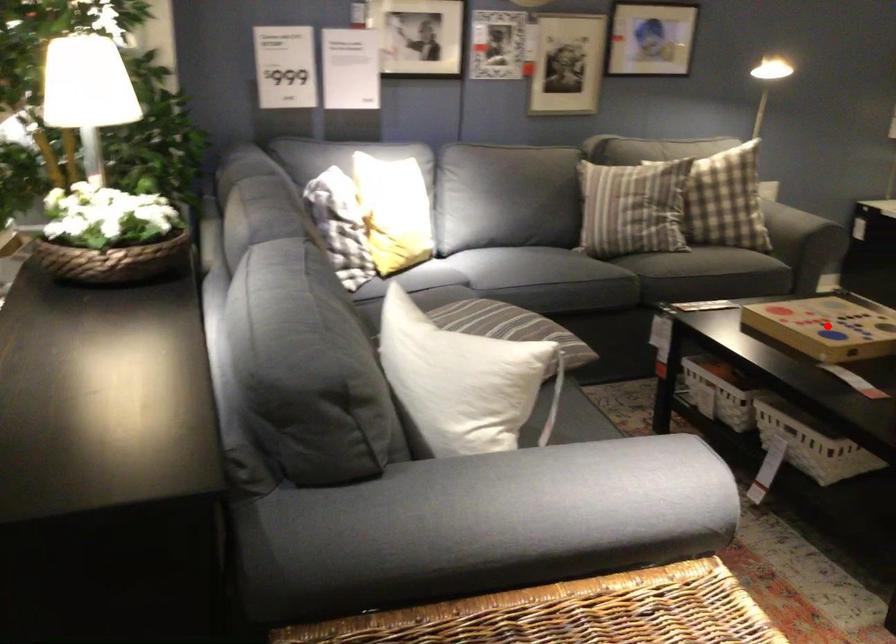
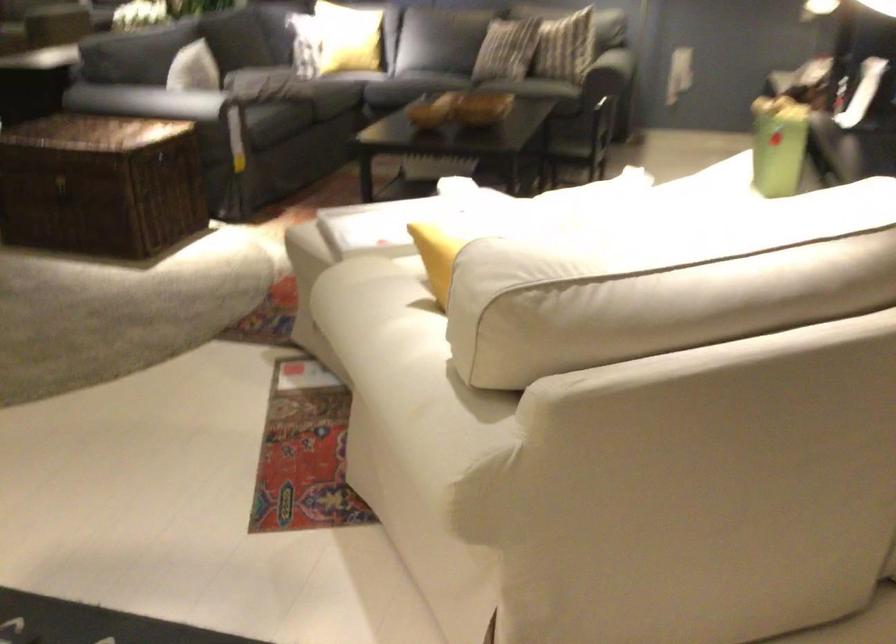
Question: I am providing you with two images of the same scene from different viewpoints. A red point is marked on the first image. At the location where the point appears in image 1, is it still visible in image 2?

Choices:
 (A) Yes
 (B) No

Answer: (B)